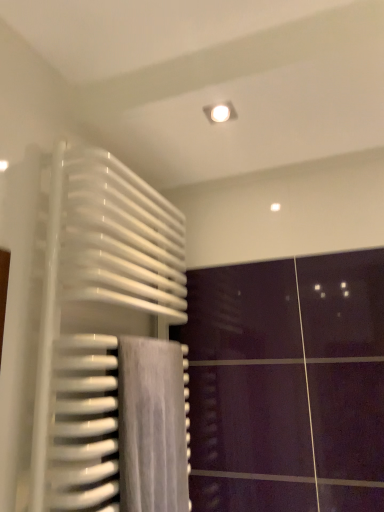
Question: Can you confirm if white glossy radiator at left is positioned to the left of gray fabric towel at lower left?

Choices:
 (A) no
 (B) yes

Answer: (B)

Question: From a real-world perspective, is white glossy radiator at left positioned over gray fabric towel at lower left based on gravity?

Choices:
 (A) no
 (B) yes

Answer: (B)

Question: Can you confirm if white glossy radiator at left is positioned to the right of gray fabric towel at lower left?

Choices:
 (A) yes
 (B) no

Answer: (B)

Question: From the image's perspective, is white glossy radiator at left above gray fabric towel at lower left?

Choices:
 (A) yes
 (B) no

Answer: (A)

Question: Would you say white glossy radiator at left is a long distance from gray fabric towel at lower left?

Choices:
 (A) yes
 (B) no

Answer: (B)

Question: From the image's perspective, is white glossy radiator at left located beneath gray fabric towel at lower left?

Choices:
 (A) no
 (B) yes

Answer: (A)

Question: Can you confirm if gray fabric towel at lower left is smaller than white glossy radiator at left?

Choices:
 (A) no
 (B) yes

Answer: (B)

Question: Is gray fabric towel at lower left not within white glossy radiator at left?

Choices:
 (A) no
 (B) yes

Answer: (A)

Question: Can you see gray fabric towel at lower left touching white glossy radiator at left?

Choices:
 (A) no
 (B) yes

Answer: (A)

Question: Does gray fabric towel at lower left have a greater height compared to white glossy radiator at left?

Choices:
 (A) yes
 (B) no

Answer: (B)

Question: From the image's perspective, does gray fabric towel at lower left appear higher than white glossy radiator at left?

Choices:
 (A) no
 (B) yes

Answer: (A)

Question: Can you confirm if gray fabric towel at lower left is positioned to the right of white glossy radiator at left?

Choices:
 (A) yes
 (B) no

Answer: (A)

Question: In the image, is white glossy radiator at left on the left side or the right side of gray fabric towel at lower left?

Choices:
 (A) left
 (B) right

Answer: (A)